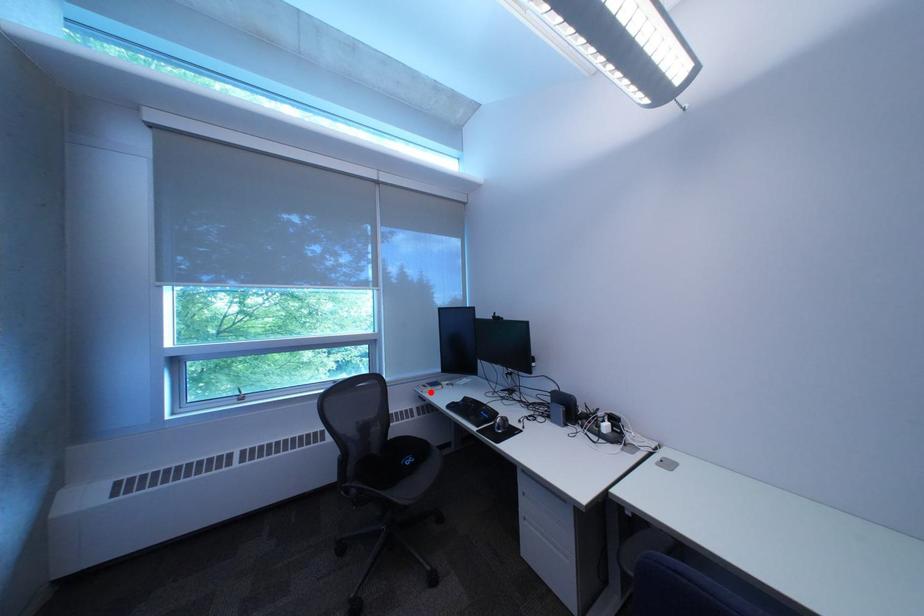
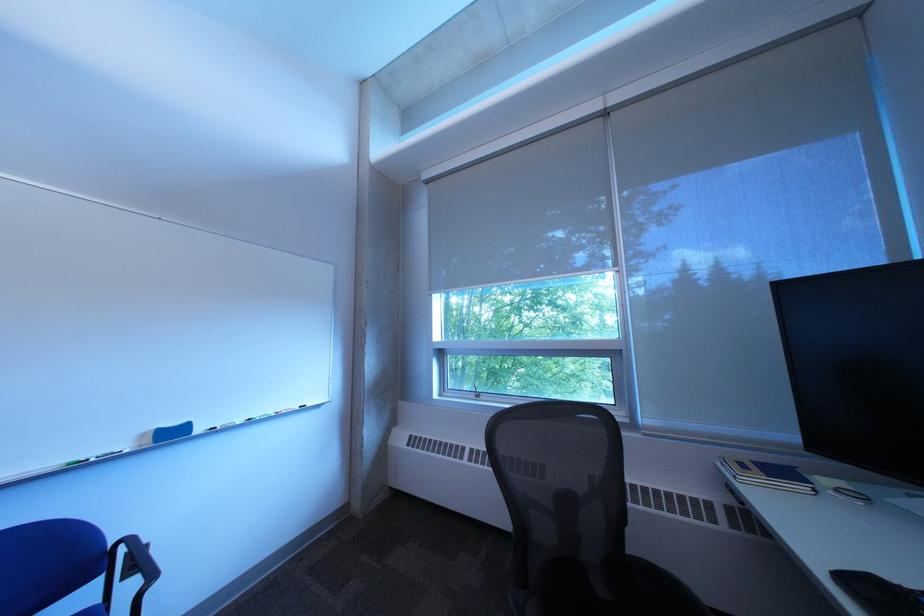
The point at the highlighted location is marked in the first image. Where is the corresponding point in the second image?

(733, 468)